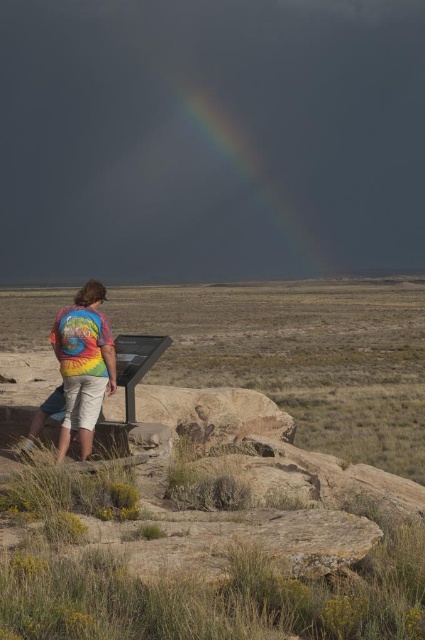
Question: Which of the following is the closest to the observer?

Choices:
 (A) (316, 268)
 (B) (65, 365)
 (C) (277, 500)

Answer: (C)

Question: From the image, what is the correct spatial relationship of rainbow at upper center in relation to tie-dye fabric shirt at center?

Choices:
 (A) below
 (B) above

Answer: (B)

Question: Can you confirm if rainbow at upper center is thinner than tie-dye fabric shirt at center?

Choices:
 (A) yes
 (B) no

Answer: (B)

Question: Which point is farther from the camera taking this photo?

Choices:
 (A) (85, 305)
 (B) (302, 225)
 (C) (215, 424)

Answer: (B)

Question: Estimate the real-world distances between objects in this image. Which object is farther from the tie-dye fabric shirt at center?

Choices:
 (A) rainbow at upper center
 (B) green grass at center

Answer: (A)

Question: Can you confirm if green grass at center is bigger than rainbow at upper center?

Choices:
 (A) yes
 (B) no

Answer: (B)